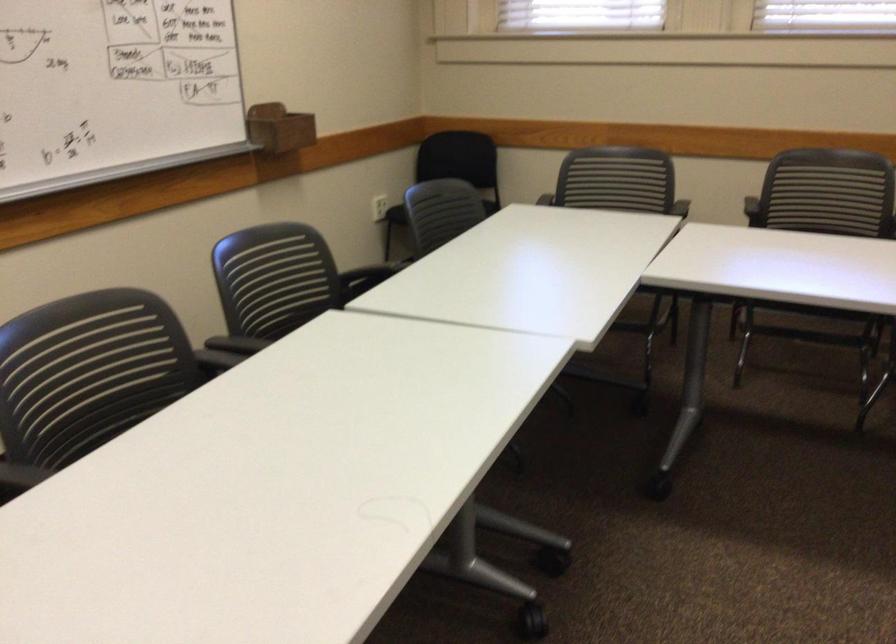
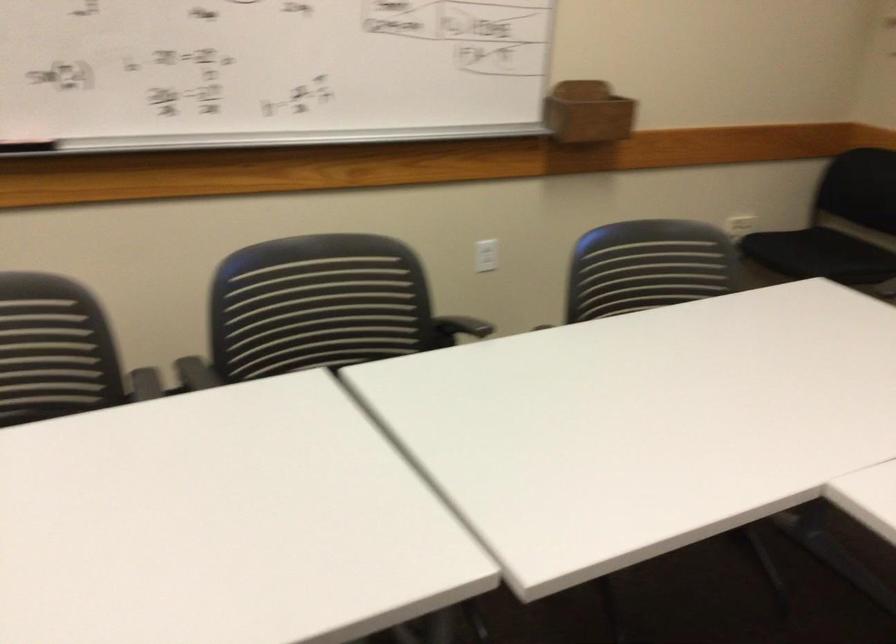
In the second image, find the point that corresponds to pixel 279 138 in the first image.

(588, 111)